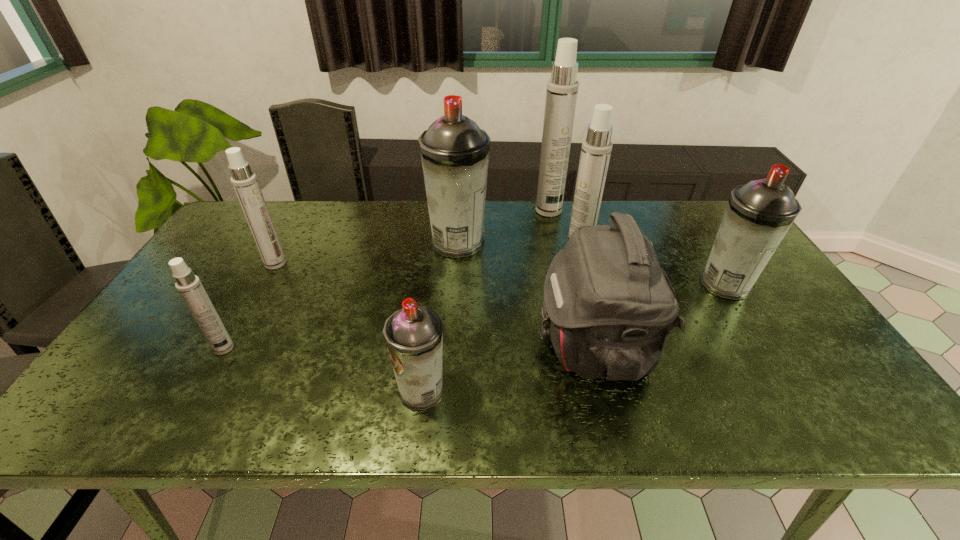
Identify the location of empty space that is in between the nearest gray aerosol can and the third biggest white aerosol can. (348, 327).

Identify the location of empty location between the nearest gray aerosol can and the third smallest white aerosol can. The image size is (960, 540). (500, 322).

Locate an element on the screen. The height and width of the screenshot is (540, 960). free area in between the third biggest white aerosol can and the second nearest aerosol can is located at coordinates (250, 306).

I want to click on vacant space that is in between the second biggest white aerosol can and the smallest gray aerosol can, so click(x=500, y=322).

At what (x,y) coordinates should I click in order to perform the action: click on free space between the third biggest white aerosol can and the smallest gray aerosol can. Please return your answer as a coordinate pair (x, y). The width and height of the screenshot is (960, 540). Looking at the image, I should click on (348, 327).

I want to click on free spot between the tallest aerosol can and the second smallest white aerosol can, so click(x=412, y=237).

I want to click on the third closest object to the biggest white aerosol can, so click(x=609, y=308).

Where is `the second closest object to the farthest gray aerosol can`? the second closest object to the farthest gray aerosol can is located at coordinates click(609, 308).

The height and width of the screenshot is (540, 960). What are the coordinates of `aerosol can identified as the third closest to the shoulder bag` in the screenshot? It's located at (454, 151).

Choose which aerosol can is the nearest neighbor to the tallest object. Please provide its 2D coordinates. Your answer should be formatted as a tuple, i.e. [(x, y)], where the tuple contains the x and y coordinates of a point satisfying the conditions above.

[(596, 149)]